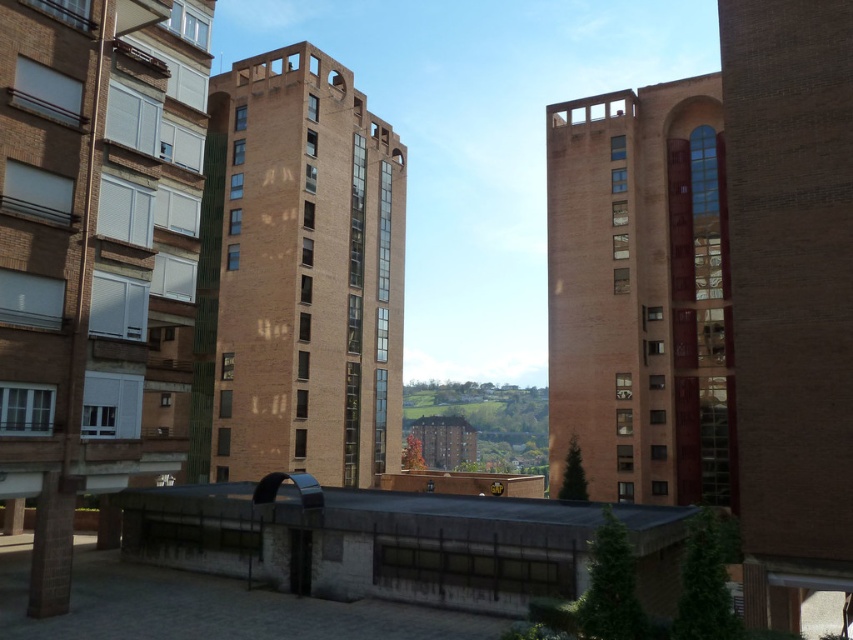
Consider the image. You are a city planner reviewing this urban layout. You need to determine the placement of a new pedestrian walkway between the brown brick building at center and the brick tower at center. Based on their positions, which building should the walkway be closer to?

The brown brick building at center is positioned on the left side of brick tower at center, so the walkway should be closer to the brown brick building at center since it is located to the left of the brick tower at center.